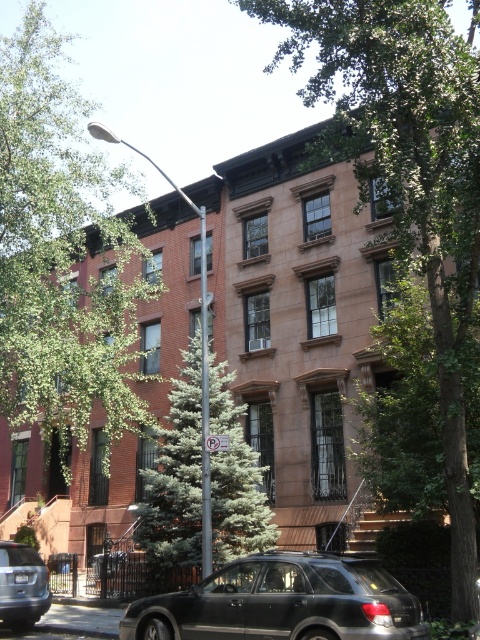
Does green leafy tree at upper left have a lesser height compared to green textured evergreen tree at center?

Incorrect, green leafy tree at upper left's height does not fall short of green textured evergreen tree at center's.

Where is `green leafy tree at upper left`? green leafy tree at upper left is located at coordinates (60, 257).

Between point (236, 564) and point (163, 563), which one is positioned behind?

Point (163, 563)

Between matte black suv at lower center and green textured evergreen tree at center, which one is positioned higher?

matte black suv at lower center is higher up.

Between point (287, 637) and point (235, 444), which one is positioned behind?

The point (235, 444) is behind.

Locate an element on the screen. matte black suv at lower center is located at coordinates (283, 602).

Who is positioned more to the right, matte black suv at lower center or matte silver sedan at lower left?

matte black suv at lower center

Between point (168, 596) and point (28, 573), which one is positioned in front?

Positioned in front is point (168, 596).

This screenshot has height=640, width=480. I want to click on matte black suv at lower center, so click(283, 602).